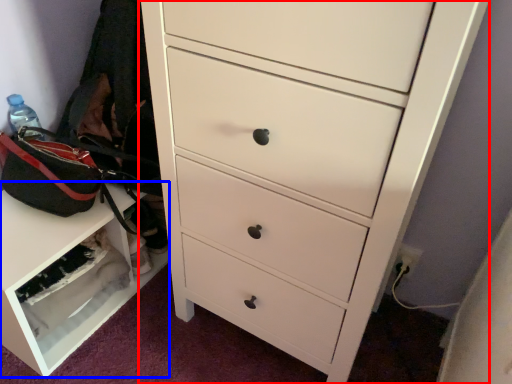
Question: Which object appears farthest to the camera in this image, chest of drawers (highlighted by a red box) or cabinetry (highlighted by a blue box)?

Choices:
 (A) chest of drawers
 (B) cabinetry

Answer: (B)